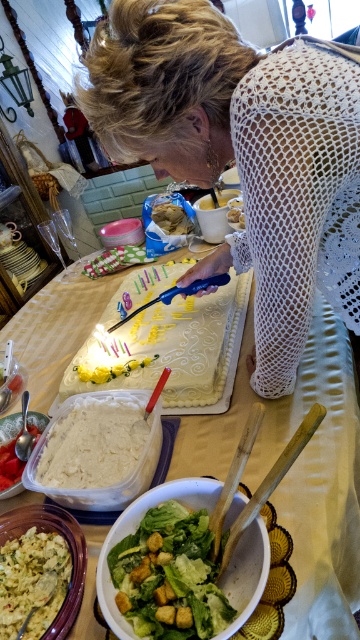
Question: Can you confirm if yellow frosted cake at center is bigger than white creamy mashed potatoes at center?

Choices:
 (A) yes
 (B) no

Answer: (A)

Question: Which point is farther to the camera?

Choices:
 (A) white mesh dress at center
 (B) green crouton salad at center
 (C) white creamy mashed potatoes at center
 (D) white textured cake at center

Answer: (C)

Question: Does white textured cake at center have a greater width compared to yellow crumbly bread at lower left?

Choices:
 (A) yes
 (B) no

Answer: (A)

Question: Does green crouton salad at center come in front of white creamy mashed potatoes at center?

Choices:
 (A) no
 (B) yes

Answer: (B)

Question: Among these points, which one is nearest to the camera?

Choices:
 (A) (48, 403)
 (B) (109, 557)

Answer: (B)

Question: Which is farther from the green crouton salad at center?

Choices:
 (A) white creamy mashed potatoes at center
 (B) yellow crumbly bread at lower left
 (C) white creamy cake at center

Answer: (C)